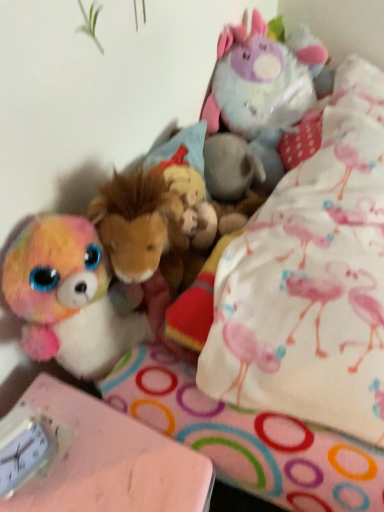
You are a GUI agent. You are given a task and a screenshot of the screen. Output one action in this format:
    pyautogui.click(x=<x>, y=<y>)
    Task: Click on the vacant space to the right of white plastic clock at lower left
    The width and height of the screenshot is (384, 512).
    Given the screenshot: What is the action you would take?
    pyautogui.click(x=107, y=461)